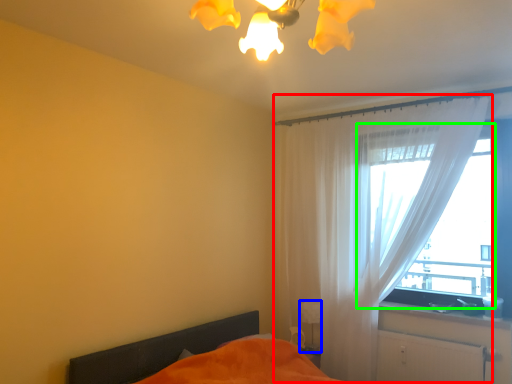
Question: Which object is the farthest from curtain (highlighted by a red box)? Choose among these: table lamp (highlighted by a blue box) or window (highlighted by a green box).

Choices:
 (A) table lamp
 (B) window

Answer: (A)